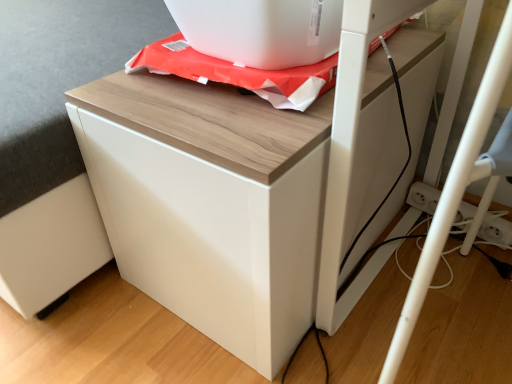
Where is `white glossy cabinet at center`? white glossy cabinet at center is located at coordinates (211, 203).

The image size is (512, 384). What do you see at coordinates (211, 203) in the screenshot?
I see `white glossy cabinet at center` at bounding box center [211, 203].

In order to face white glossy cabinet at center, should I rotate leftwards or rightwards?

Turn right by 3.195 degrees to look at white glossy cabinet at center.

Describe the element at coordinates (261, 30) in the screenshot. I see `white glossy appliance at upper center` at that location.

Identify the location of white glossy appliance at upper center. Image resolution: width=512 pixels, height=384 pixels. (261, 30).

Find the location of a particular element. The height and width of the screenshot is (384, 512). white glossy cabinet at center is located at coordinates (211, 203).

Based on their positions, is white glossy appliance at upper center located to the left or right of white glossy cabinet at center?

white glossy appliance at upper center is to the right of white glossy cabinet at center.

Is white glossy appliance at upper center behind white glossy cabinet at center?

Yes, white glossy appliance at upper center is behind white glossy cabinet at center.

Does point (334, 43) come in front of point (113, 124)?

No, (334, 43) is behind (113, 124).

From the image's perspective, who appears lower, white glossy appliance at upper center or white glossy cabinet at center?

white glossy cabinet at center.

From a real-world perspective, is white glossy appliance at upper center over white glossy cabinet at center?

Correct, in the physical world, white glossy appliance at upper center is higher than white glossy cabinet at center.

Which object is thinner, white glossy appliance at upper center or white glossy cabinet at center?

With smaller width is white glossy appliance at upper center.

Which of these two, white glossy appliance at upper center or white glossy cabinet at center, stands taller?

white glossy cabinet at center.

Is white glossy appliance at upper center bigger than white glossy cabinet at center?

Actually, white glossy appliance at upper center might be smaller than white glossy cabinet at center.

Is white glossy appliance at upper center situated inside white glossy cabinet at center or outside?

white glossy appliance at upper center is spatially situated outside white glossy cabinet at center.

Is white glossy appliance at upper center far from white glossy cabinet at center?

No.

Is white glossy appliance at upper center facing away from white glossy cabinet at center?

No, white glossy appliance at upper center is not facing the opposite direction of white glossy cabinet at center.

Can you tell me how much white glossy appliance at upper center and white glossy cabinet at center differ in facing direction?

The facing directions of white glossy appliance at upper center and white glossy cabinet at center are 93.6 degrees apart.

Where is `furniture below the white glossy appliance at upper center (from the image's perspective)`? The image size is (512, 384). furniture below the white glossy appliance at upper center (from the image's perspective) is located at coordinates (211, 203).

Would you say white glossy cabinet at center is to the left or to the right of white glossy appliance at upper center in the picture?

white glossy cabinet at center is positioned on white glossy appliance at upper center's left side.

Considering the positions of objects white glossy cabinet at center and white glossy appliance at upper center in the image provided, who is behind, white glossy cabinet at center or white glossy appliance at upper center?

white glossy appliance at upper center is behind.

Is point (329, 118) in front of point (286, 50)?

Yes, it is.

From the image's perspective, between white glossy cabinet at center and white glossy appliance at upper center, who is located below?

white glossy cabinet at center, from the image's perspective.

From a real-world perspective, who is located higher, white glossy cabinet at center or white glossy appliance at upper center?

In real-world perspective, white glossy appliance at upper center is above.

Is white glossy cabinet at center wider than white glossy appliance at upper center?

Indeed, white glossy cabinet at center has a greater width compared to white glossy appliance at upper center.

Who is shorter, white glossy cabinet at center or white glossy appliance at upper center?

white glossy appliance at upper center is shorter.

In terms of size, does white glossy cabinet at center appear bigger or smaller than white glossy appliance at upper center?

white glossy cabinet at center is bigger than white glossy appliance at upper center.

Is white glossy cabinet at center not inside white glossy appliance at upper center?

That's correct, white glossy cabinet at center is outside of white glossy appliance at upper center.

Is white glossy cabinet at center in contact with white glossy appliance at upper center?

No, white glossy cabinet at center is not beside white glossy appliance at upper center.

Is white glossy cabinet at center facing towards white glossy appliance at upper center?

No, white glossy cabinet at center is not facing towards white glossy appliance at upper center.

Where is `furniture located on the left of white glossy appliance at upper center`? The image size is (512, 384). furniture located on the left of white glossy appliance at upper center is located at coordinates (211, 203).

I want to click on furniture below the white glossy appliance at upper center (from the image's perspective), so click(x=211, y=203).

This screenshot has width=512, height=384. In order to click on appliance that appears behind the white glossy cabinet at center in this screenshot , I will do `click(261, 30)`.